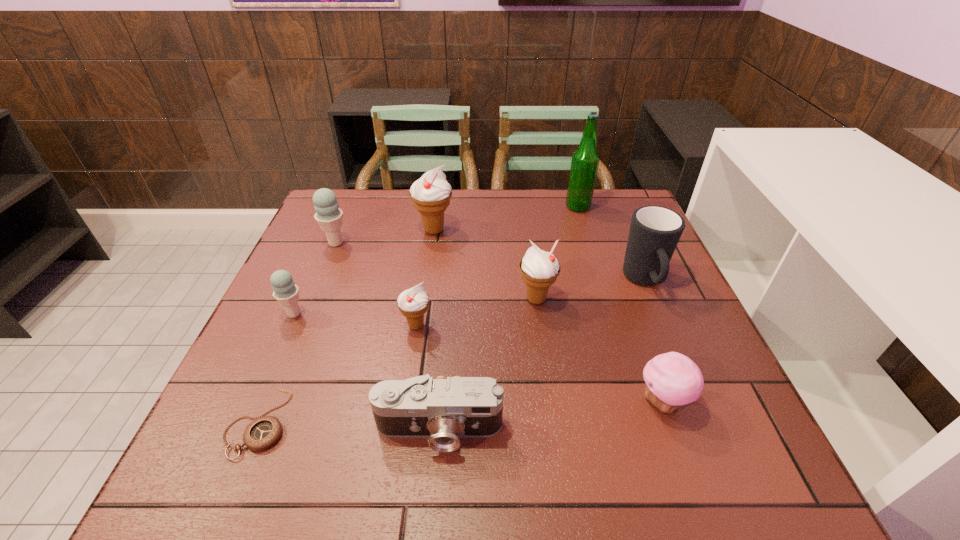
This screenshot has height=540, width=960. Identify the location of free spot between the second biggest white icecream and the pink cupcake. (599, 350).

The image size is (960, 540). What are the coordinates of `unoccupied position between the camera and the second nearest white icecream` in the screenshot? It's located at (488, 364).

Where is `unoccupied area between the shortest object and the nearer blue ice cream`? This screenshot has width=960, height=540. unoccupied area between the shortest object and the nearer blue ice cream is located at coordinates (276, 368).

In order to click on free spot between the smallest white icecream and the tallest icecream in this screenshot , I will do pyautogui.click(x=425, y=278).

Where is `free space that is in between the smaller blue ice cream and the farther blue ice cream`? This screenshot has width=960, height=540. free space that is in between the smaller blue ice cream and the farther blue ice cream is located at coordinates (315, 278).

You are a GUI agent. You are given a task and a screenshot of the screen. Output one action in this format:
    pyautogui.click(x=<x>, y=<y>)
    Task: Click on the free space between the farther blue ice cream and the smallest white icecream
    This screenshot has width=960, height=540.
    Given the screenshot: What is the action you would take?
    (x=376, y=284)

What are the coordinates of `vacant area that lies between the farthest object and the pink cupcake` in the screenshot? It's located at (x=620, y=304).

The width and height of the screenshot is (960, 540). Find the location of `empty space between the nearest white icecream and the farther blue ice cream`. empty space between the nearest white icecream and the farther blue ice cream is located at coordinates (376, 284).

Select which object appears as the closest to the pocket watch. Please provide its 2D coordinates. Your answer should be formatted as a tuple, i.e. [(x, y)], where the tuple contains the x and y coordinates of a point satisfying the conditions above.

[(443, 410)]

Identify which object is the fourth closest to the smallest white icecream. Please provide its 2D coordinates. Your answer should be formatted as a tuple, i.e. [(x, y)], where the tuple contains the x and y coordinates of a point satisfying the conditions above.

[(285, 291)]